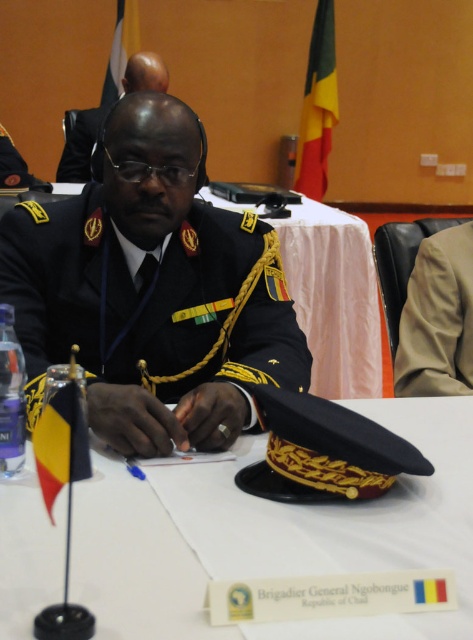
Is white paper at center positioned in front of black matte uniform at center?

That is True.

Does white paper at center have a lesser height compared to black matte uniform at center?

Correct, white paper at center is not as tall as black matte uniform at center.

The height and width of the screenshot is (640, 473). What do you see at coordinates (273, 536) in the screenshot?
I see `white paper at center` at bounding box center [273, 536].

You are a GUI agent. You are given a task and a screenshot of the screen. Output one action in this format:
    pyautogui.click(x=<x>, y=<y>)
    Task: Click on the white paper at center
    The width and height of the screenshot is (473, 640).
    Given the screenshot: What is the action you would take?
    pyautogui.click(x=273, y=536)

Is beige fabric jacket at right closer to the viewer compared to black uniform at center?

Yes, beige fabric jacket at right is in front of black uniform at center.

Who is more distant from viewer, (460, 321) or (94, 108)?

The point (94, 108) is more distant.

I want to click on beige fabric jacket at right, so click(x=437, y=317).

Does white paper at center appear on the left side of beige fabric jacket at right?

Correct, you'll find white paper at center to the left of beige fabric jacket at right.

Which is behind, point (15, 515) or point (450, 298)?

The point (450, 298) is behind.

The height and width of the screenshot is (640, 473). What are the coordinates of `white paper at center` in the screenshot? It's located at (273, 536).